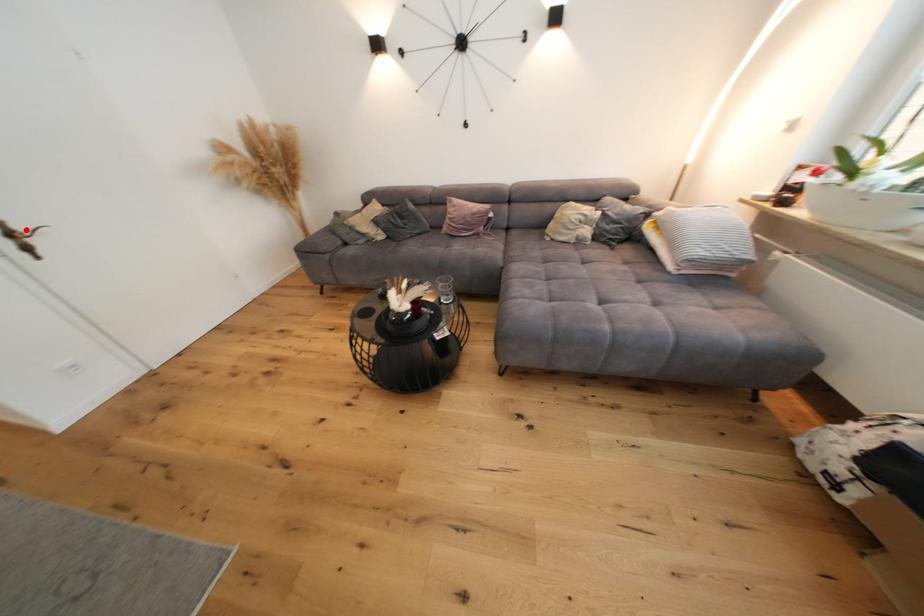
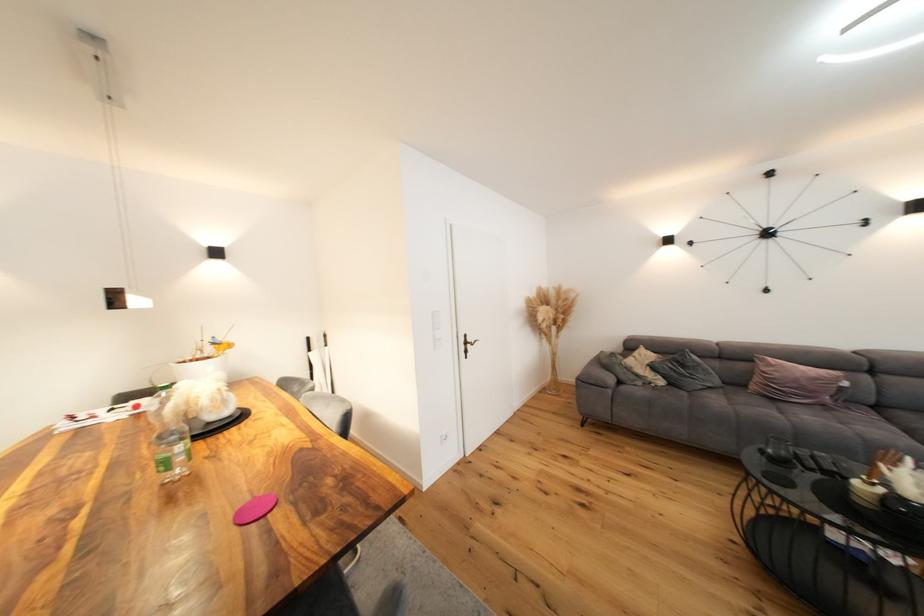
The point at the highlighted location is marked in the first image. Where is the corresponding point in the second image?

(476, 341)